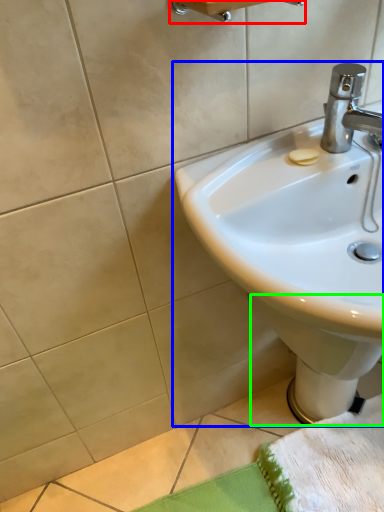
Question: Which object is positioned farthest from towel bar (highlighted by a red box)? Select from sink (highlighted by a blue box) and bidet (highlighted by a green box).

Choices:
 (A) sink
 (B) bidet

Answer: (B)